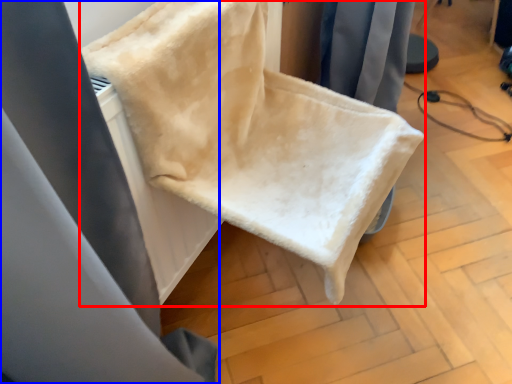
Question: Among these objects, which one is farthest to the camera, furniture (highlighted by a red box) or curtain (highlighted by a blue box)?

Choices:
 (A) furniture
 (B) curtain

Answer: (B)